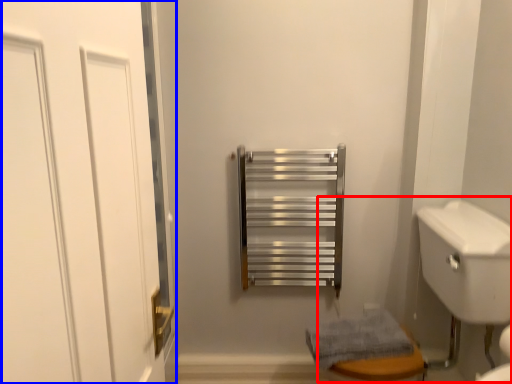
Question: Which object is closer to the camera taking this photo, sink (highlighted by a red box) or door (highlighted by a blue box)?

Choices:
 (A) sink
 (B) door

Answer: (B)